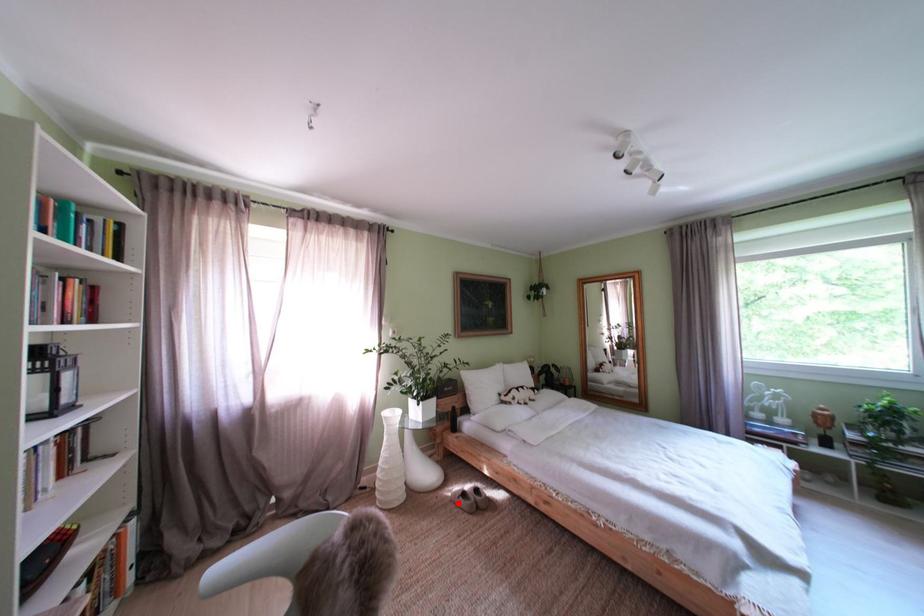
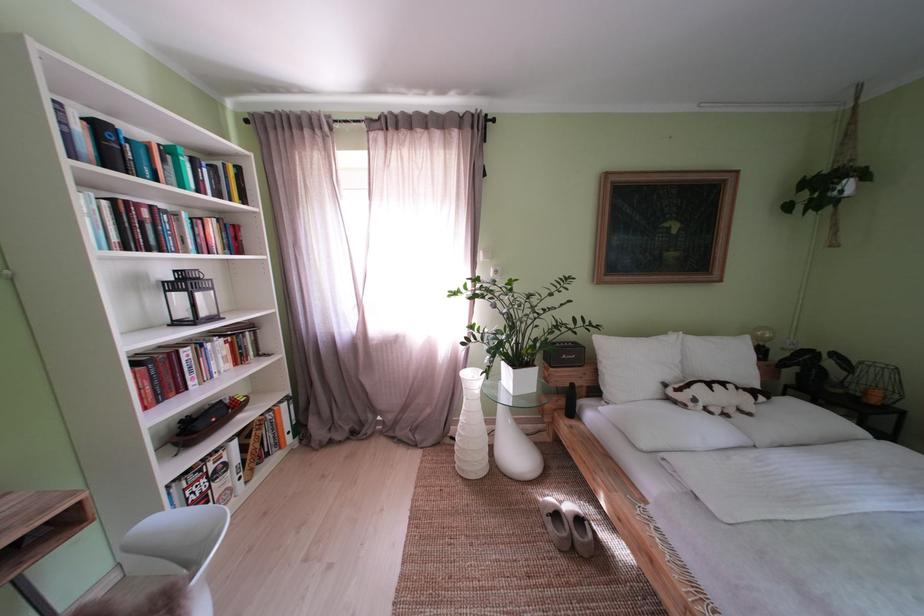
Question: I am providing you with two images of the same scene from different viewpoints. In image1, a red point is highlighted. Considering the same 3D point in image2, which of the following is correct?

Choices:
 (A) It is closer
 (B) It is farther

Answer: (A)